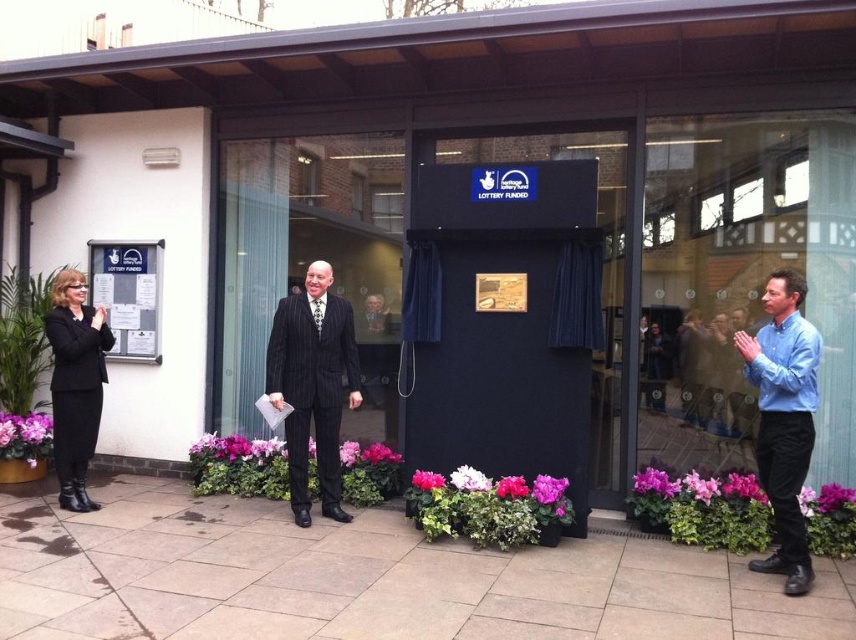
Question: Is pinstriped suit at center positioned behind black leather jacket at left?

Choices:
 (A) no
 (B) yes

Answer: (A)

Question: Can you confirm if blue shirt at right is positioned below black leather jacket at left?

Choices:
 (A) no
 (B) yes

Answer: (B)

Question: Which object is closer to the camera taking this photo?

Choices:
 (A) blue fabric curtain at center
 (B) pinstriped suit at center
 (C) blue shirt at right

Answer: (C)

Question: Is blue fabric curtain at center positioned before pinstriped suit at center?

Choices:
 (A) yes
 (B) no

Answer: (A)

Question: Among these objects, which one is farthest from the camera?

Choices:
 (A) blue fabric curtain at center
 (B) pinstriped suit at center
 (C) black leather jacket at left

Answer: (C)

Question: Which of the following is the closest to the observer?

Choices:
 (A) pinstriped suit at center
 (B) blue shirt at right

Answer: (B)